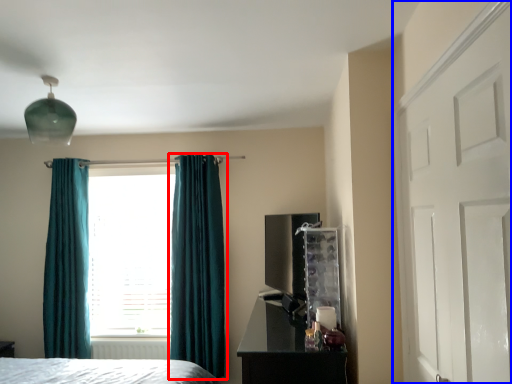
Question: Among these objects, which one is nearest to the camera, curtain (highlighted by a red box) or door (highlighted by a blue box)?

Choices:
 (A) curtain
 (B) door

Answer: (B)